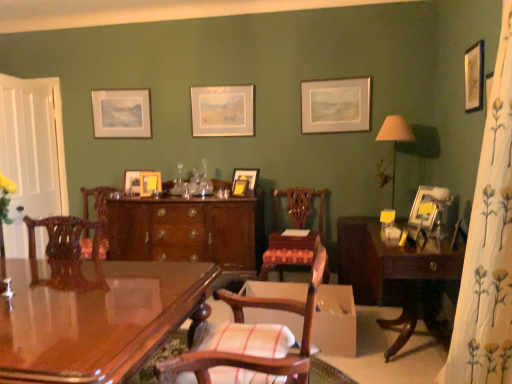
Question: In terms of size, does matte wooden picture frame at upper left, positioned as the 9th picture frame in front-to-back order, appear bigger or smaller than matte yellow picture frame at center, the 5th picture frame viewed from the right?

Choices:
 (A) small
 (B) big

Answer: (B)

Question: Does point (146, 135) appear closer or farther from the camera than point (239, 193)?

Choices:
 (A) closer
 (B) farther

Answer: (B)

Question: Which of these objects is positioned closest to the matte yellow picture frame at center, which ranks as the 4th picture frame in back-to-front order?

Choices:
 (A) wooden picture frame at center, which is the eighth picture frame from right to left
 (B) mahogany cabinet at center
 (C) glossy wood desk at center
 (D) white wood screen door at left
 (E) beige fabric lampshade at right

Answer: (A)

Question: Estimate the real-world distances between objects in this image. Which object is closer to the glossy wood desk at center?

Choices:
 (A) mahogany cabinet at center
 (B) matte yellow picture frame at center, which ranks as the 4th picture frame in back-to-front order
 (C) matte yellow picture frame at center, the 5th picture frame viewed from the right
 (D) matte wooden picture frame at upper left, marked as the ninth picture frame in a right-to-left arrangement
 (E) wooden picture frame at center, the 8th picture frame when ordered from front to back

Answer: (A)